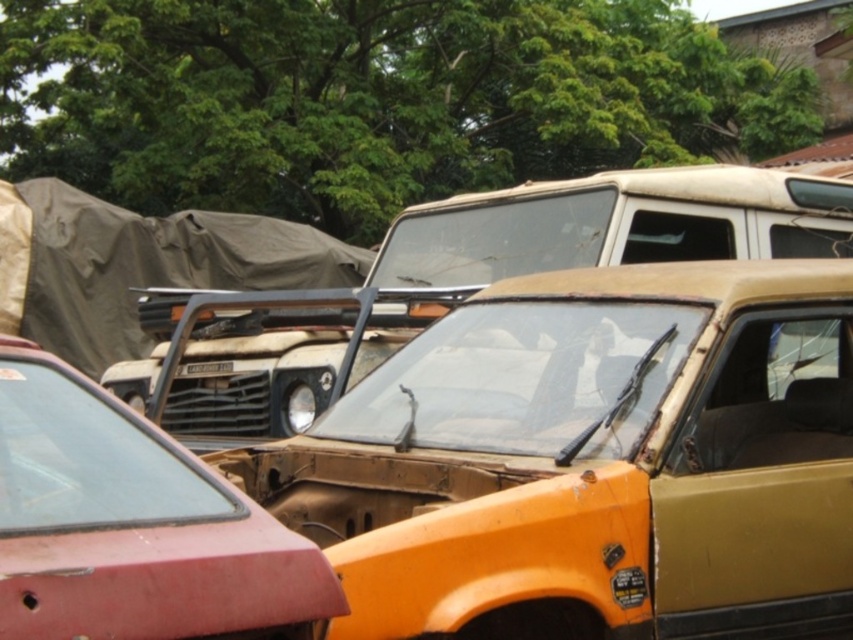
You are a mechanic trying to tow the rusty metal pickup truck at center and the matte red car at lower left using a trailer that can only accommodate vehicles up to 2 meters in width. According to the scene, which vehicle might not fit on the trailer?

The rusty metal pickup truck at center has a larger width than the matte red car at lower left, so the rusty metal pickup truck at center might not fit on the trailer since it exceeds the 2 meters width limit.

Consider the image. You are a mechanic trying to assess which vehicle to repair first. Given that the rusty metal pickup truck at center is taller than the matte red car at lower left, which vehicle would require more space in your workshop to accommodate its height?

The rusty metal pickup truck at center requires more space in the workshop because it is taller than the matte red car at lower left.